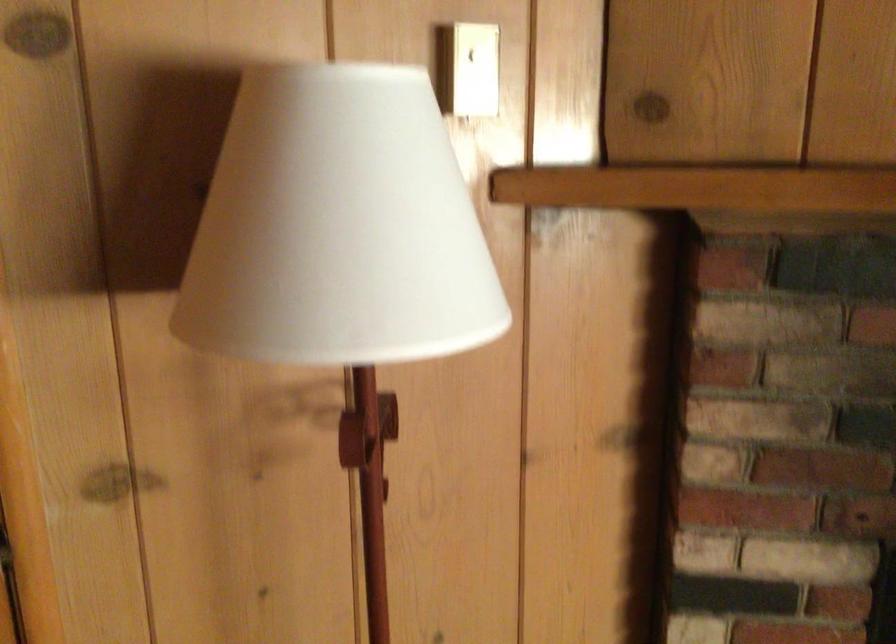
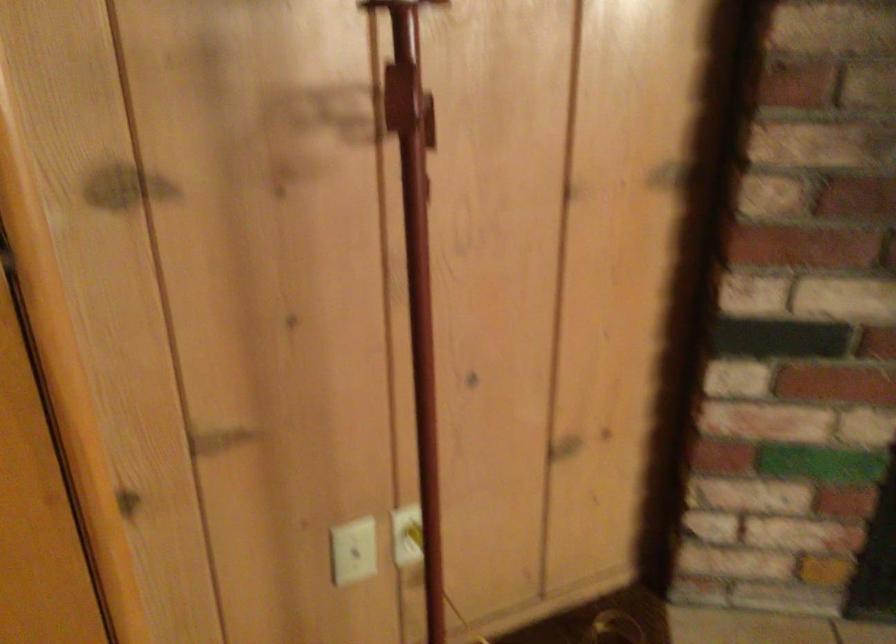
Locate, in the second image, the point that corresponds to pixel 355 453 in the first image.

(399, 98)